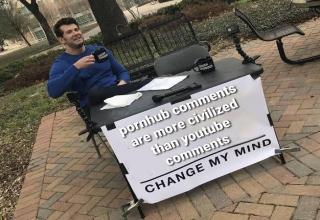
Identify the location of coffee mugs. (98, 54), (206, 63).